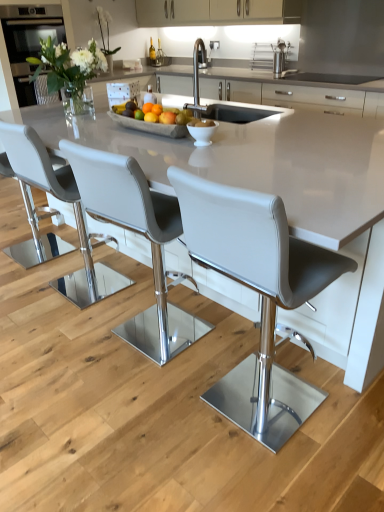
Where is `free space in front of white ceramic bowl at center`? This screenshot has height=512, width=384. free space in front of white ceramic bowl at center is located at coordinates (224, 152).